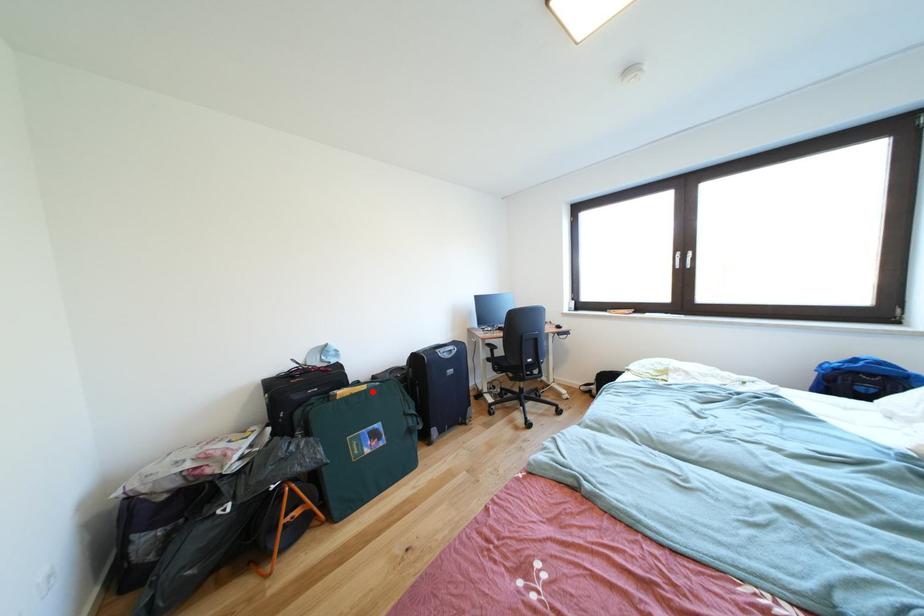
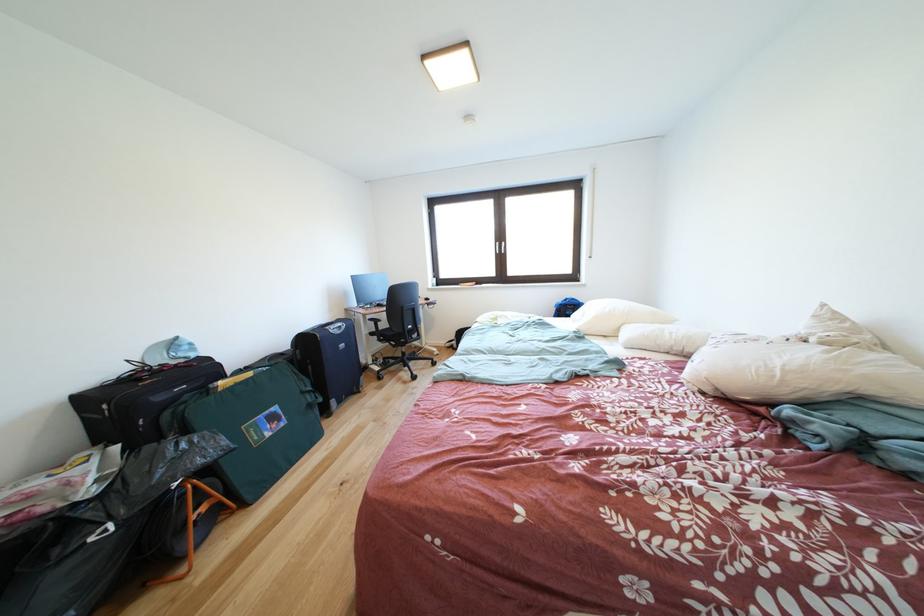
Question: I am providing you with two images of the same scene from different viewpoints. A red point is marked on the first image. Can you still see the location of the red point in image 2?

Choices:
 (A) Yes
 (B) No

Answer: (A)